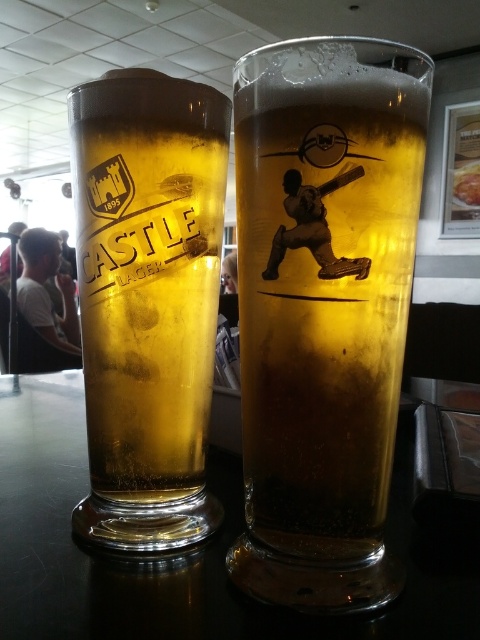
Question: Can you confirm if clear glass castle lager at left is wider than white t-shirt at left?

Choices:
 (A) yes
 (B) no

Answer: (B)

Question: Which point is closer to the camera?

Choices:
 (A) (17, 492)
 (B) (406, 180)
 (C) (187, 369)
 (D) (67, 332)

Answer: (B)

Question: Which point is closer to the camera?

Choices:
 (A) (64, 292)
 (B) (12, 616)
 (C) (269, 289)
 (D) (97, 221)

Answer: (B)

Question: Which point is closer to the camera taking this photo?

Choices:
 (A) (36, 515)
 (B) (48, 234)

Answer: (A)

Question: Is translucent glass beer at center to the left of clear glass castle lager at left from the viewer's perspective?

Choices:
 (A) no
 (B) yes

Answer: (A)

Question: Is translucent glass beer at center below white t-shirt at left?

Choices:
 (A) no
 (B) yes

Answer: (B)